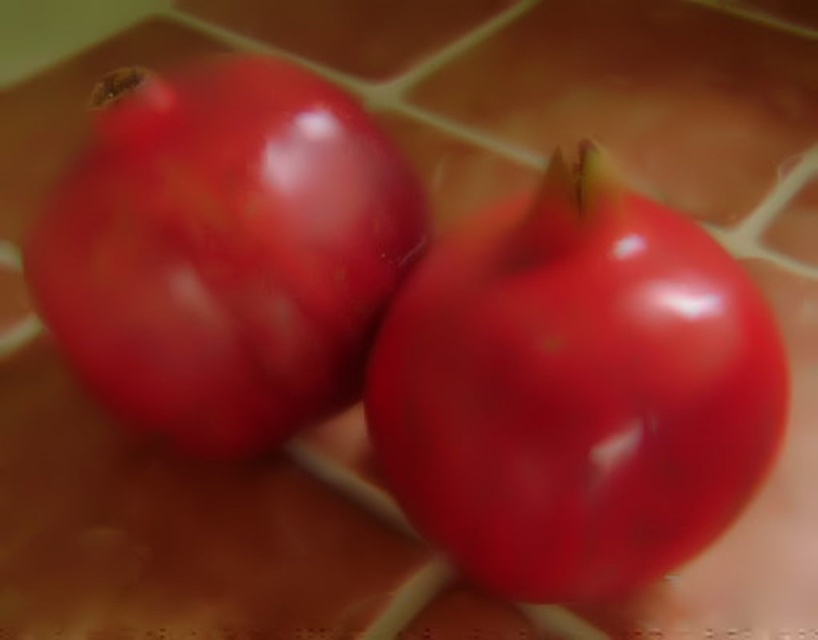
Question: Is glossy red tomato at center above glossy red tomato at left?

Choices:
 (A) yes
 (B) no

Answer: (B)

Question: Does glossy red tomato at center appear under glossy red tomato at left?

Choices:
 (A) no
 (B) yes

Answer: (B)

Question: Is glossy red tomato at center positioned in front of glossy red tomato at left?

Choices:
 (A) no
 (B) yes

Answer: (B)

Question: Which point appears closest to the camera in this image?

Choices:
 (A) (466, 259)
 (B) (348, 218)

Answer: (A)

Question: Which point is closer to the camera taking this photo?

Choices:
 (A) (275, 387)
 (B) (572, 554)

Answer: (B)

Question: Among these points, which one is nearest to the camera?

Choices:
 (A) (70, 301)
 (B) (754, 404)

Answer: (B)